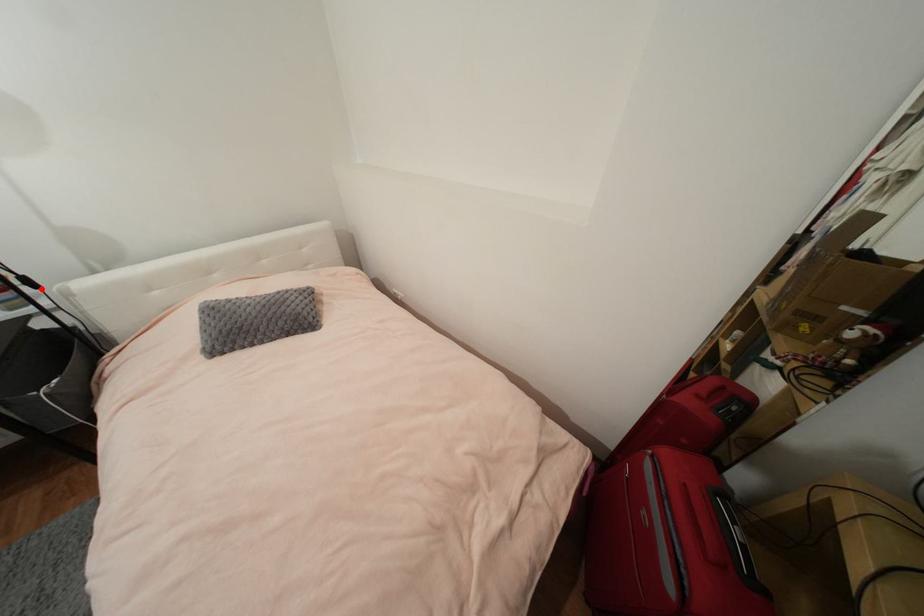
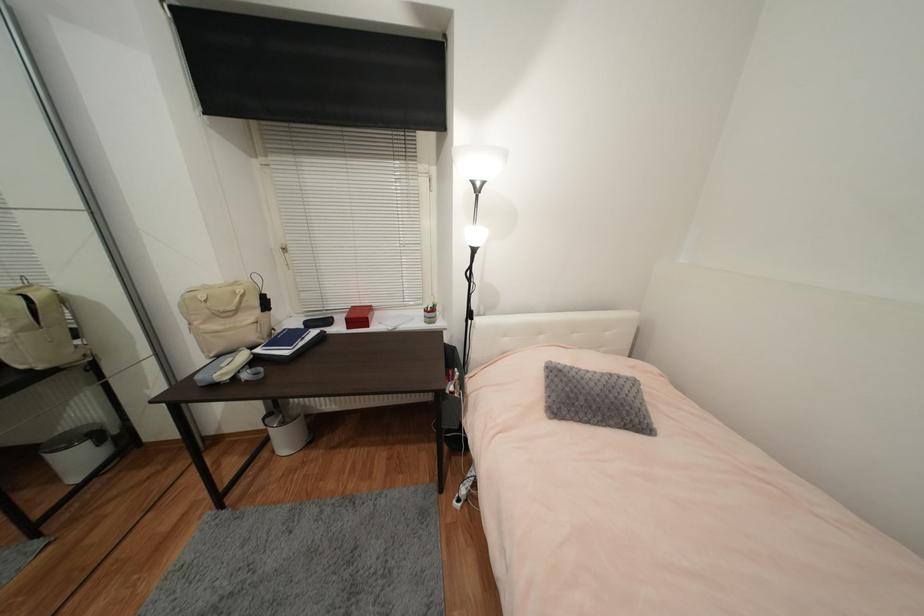
Find the pixel in the second image that matches the highlighted location in the first image.

(477, 320)